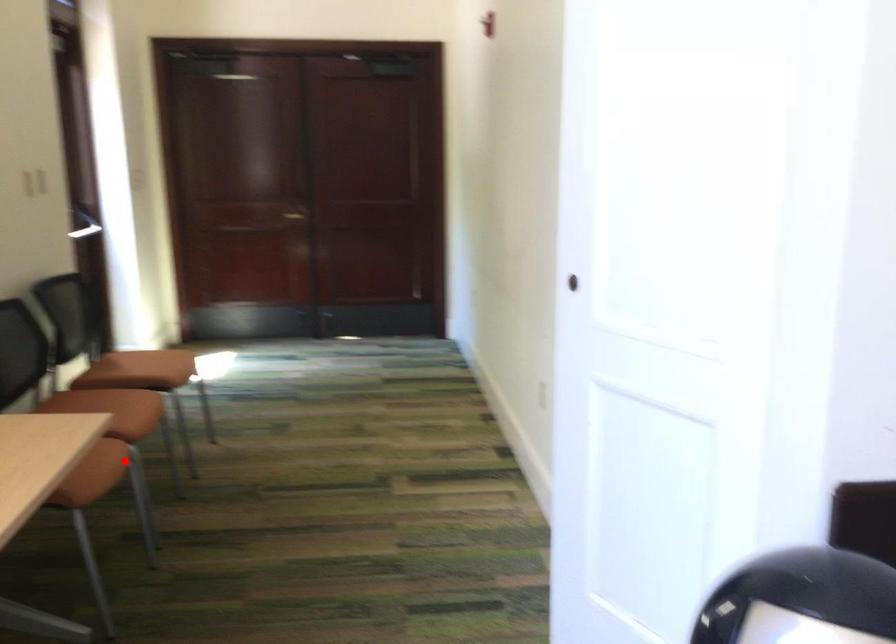
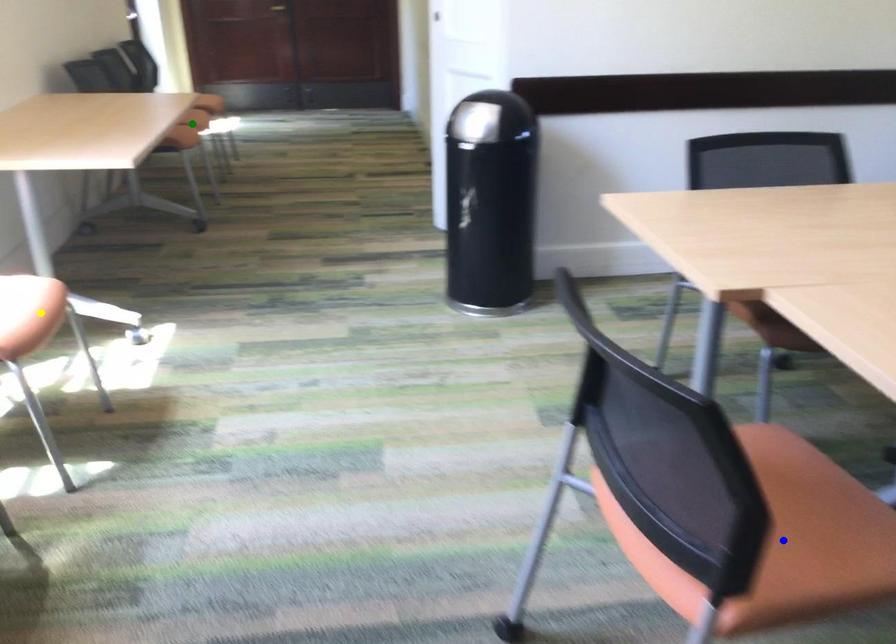
Question: I am providing you with two images of the same scene from different viewpoints. A red point is marked on the first image. You are given multiple points on the second image. Which mark in image 2 goes with the point in image 1?

Choices:
 (A) yellow point
 (B) blue point
 (C) green point

Answer: (C)